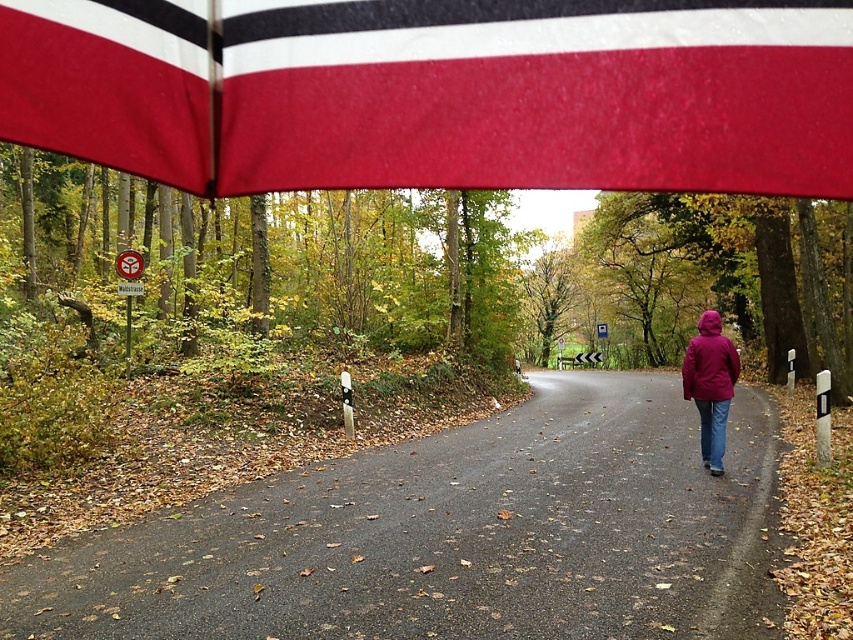
How far apart are brown asphalt road at center and matte purple jacket at right?

The distance of brown asphalt road at center from matte purple jacket at right is 11.04 feet.

Does brown asphalt road at center lie in front of matte purple jacket at right?

Yes, brown asphalt road at center is closer to the viewer.

Is point (410, 461) positioned before point (730, 362)?

No, (410, 461) is further to viewer.

Find the location of `brown asphalt road at center`. brown asphalt road at center is located at coordinates (450, 536).

This screenshot has width=853, height=640. What do you see at coordinates (438, 92) in the screenshot?
I see `red fabric flag at upper center` at bounding box center [438, 92].

Is red fabric flag at upper center closer to the viewer compared to brown asphalt road at center?

Yes, it is in front of brown asphalt road at center.

Image resolution: width=853 pixels, height=640 pixels. I want to click on red fabric flag at upper center, so click(438, 92).

The image size is (853, 640). What are the coordinates of `red fabric flag at upper center` in the screenshot? It's located at (438, 92).

Is red fabric flag at upper center wider than matte purple jacket at right?

Yes, red fabric flag at upper center is wider than matte purple jacket at right.

Find the location of a particular element. red fabric flag at upper center is located at coordinates click(438, 92).

Locate an element on the screen. The width and height of the screenshot is (853, 640). red fabric flag at upper center is located at coordinates (438, 92).